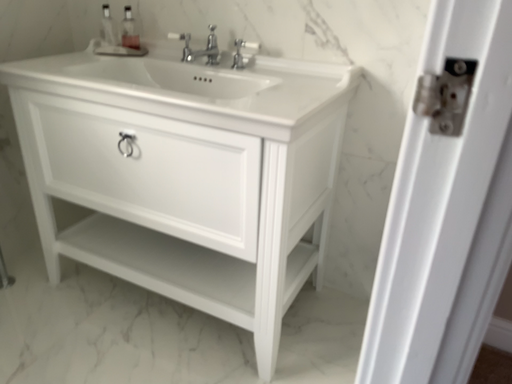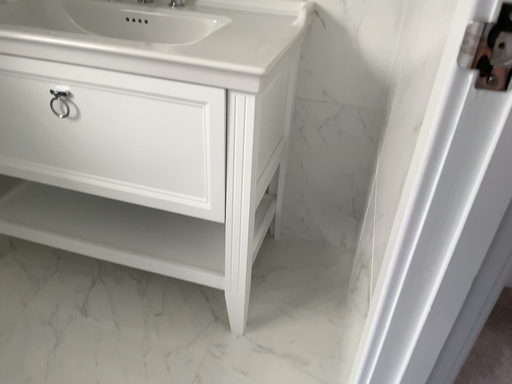
Question: Which way did the camera rotate in the video?

Choices:
 (A) rotated upward
 (B) rotated downward

Answer: (B)